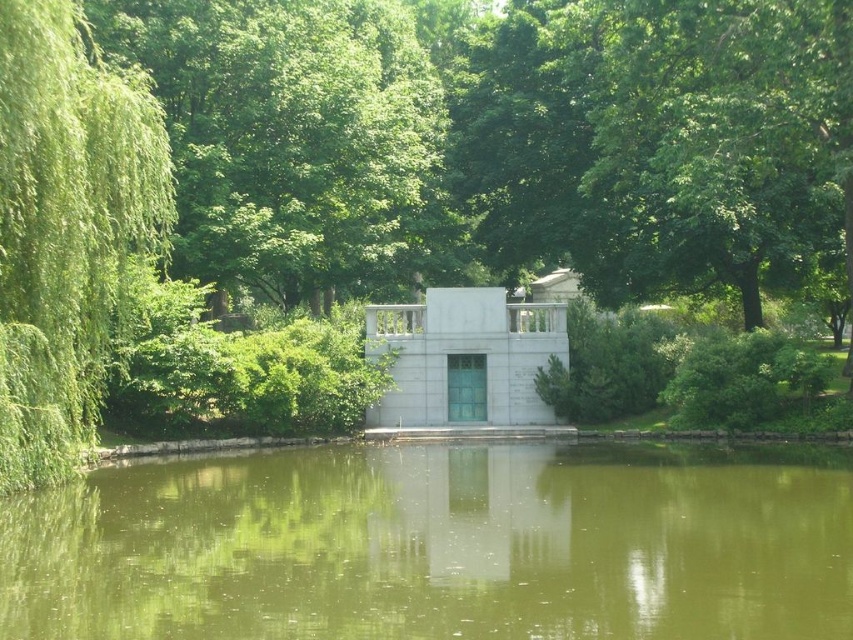
You are a park visitor standing at the edge of the greenish murky water at center and want to take a photo of the green leafy tree at upper left. Which object would appear larger in the photo if you don not move your camera?

The green leafy tree at upper left would appear larger in the photo because it is larger in size compared to the greenish murky water at center.